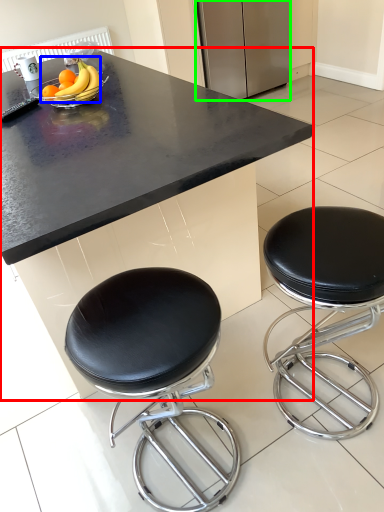
Question: Considering the real-world distances, which object is farthest from table (highlighted by a red box)? banana (highlighted by a blue box) or appliance (highlighted by a green box)?

Choices:
 (A) banana
 (B) appliance

Answer: (B)